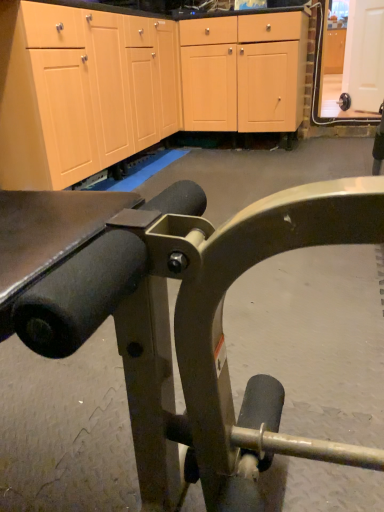
Question: Considering the relative positions of matte wood cabinet at upper right, which appears as the second cabinetry when viewed from the front, and light wood/veneer cabinets at center, the first cabinetry in the bottom-to-top sequence, in the image provided, is matte wood cabinet at upper right, which appears as the second cabinetry when viewed from the front, to the right of light wood/veneer cabinets at center, the first cabinetry in the bottom-to-top sequence, from the viewer's perspective?

Choices:
 (A) yes
 (B) no

Answer: (A)

Question: From a real-world perspective, is matte wood cabinet at upper right, the first cabinetry viewed from the right, below light wood/veneer cabinets at center, which is the 2th cabinetry from right to left?

Choices:
 (A) no
 (B) yes

Answer: (A)

Question: Can you confirm if matte wood cabinet at upper right, the 2th cabinetry from the bottom, is wider than light wood/veneer cabinets at center, arranged as the second cabinetry when viewed from the top?

Choices:
 (A) no
 (B) yes

Answer: (B)

Question: Are matte wood cabinet at upper right, which appears as the second cabinetry when viewed from the front, and light wood/veneer cabinets at center, the first cabinetry positioned from the left, located far from each other?

Choices:
 (A) yes
 (B) no

Answer: (A)

Question: Is light wood/veneer cabinets at center, the first cabinetry positioned from the left, a part of matte wood cabinet at upper right, the second cabinetry in the left-to-right sequence?

Choices:
 (A) yes
 (B) no

Answer: (B)

Question: Can you confirm if matte wood cabinet at upper right, the 2th cabinetry from the bottom, is bigger than light wood/veneer cabinets at center, arranged as the 1th cabinetry when viewed from the front?

Choices:
 (A) no
 (B) yes

Answer: (A)

Question: Can you confirm if light wood/veneer cabinets at center, the first cabinetry positioned from the left, is bigger than matte wood cabinet at upper right, the 1th cabinetry viewed from the back?

Choices:
 (A) no
 (B) yes

Answer: (B)

Question: Is light wood/veneer cabinets at center, arranged as the 1th cabinetry when viewed from the front, to the right of matte wood cabinet at upper right, which appears as the second cabinetry when viewed from the front, from the viewer's perspective?

Choices:
 (A) no
 (B) yes

Answer: (A)

Question: Is light wood/veneer cabinets at center, arranged as the second cabinetry when viewed from the top, taller than matte wood cabinet at upper right, the 1th cabinetry viewed from the back?

Choices:
 (A) no
 (B) yes

Answer: (A)

Question: From a real-world perspective, is light wood/veneer cabinets at center, the 2th cabinetry when ordered from back to front, physically above matte wood cabinet at upper right, the 2th cabinetry from the bottom?

Choices:
 (A) no
 (B) yes

Answer: (A)

Question: Does light wood/veneer cabinets at center, the first cabinetry positioned from the left, turn towards matte wood cabinet at upper right, which ranks as the first cabinetry in top-to-bottom order?

Choices:
 (A) yes
 (B) no

Answer: (B)

Question: Does light wood/veneer cabinets at center, arranged as the 1th cabinetry when viewed from the front, have a lesser width compared to matte wood cabinet at upper right, which appears as the second cabinetry when viewed from the front?

Choices:
 (A) no
 (B) yes

Answer: (B)

Question: Is light wood/veneer cabinets at center, the 2th cabinetry when ordered from back to front, bigger or smaller than matte wood cabinet at upper right, the first cabinetry viewed from the right?

Choices:
 (A) small
 (B) big

Answer: (B)